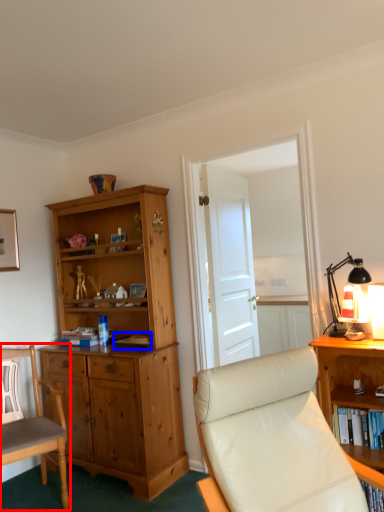
Question: Which object appears closest to the camera in this image, chair (highlighted by a red box) or book (highlighted by a blue box)?

Choices:
 (A) chair
 (B) book

Answer: (A)